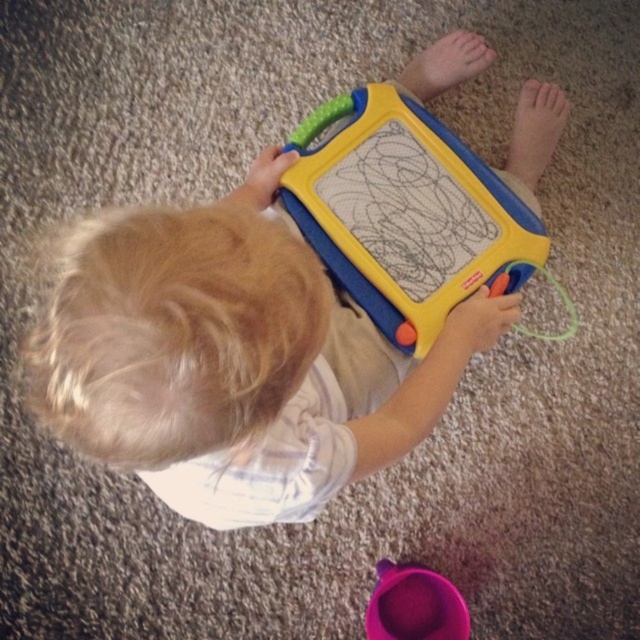
You are a parent observing your child playing with the yellow plastic drawing board at center and the purple plastic cup at lower center. Which object is bigger?

The yellow plastic drawing board at center is larger in size than the purple plastic cup at lower center.

Consider the image. You are a parent observing your child playing with the yellow plastic toy at center and the yellow plastic drawing board at center. Which object is positioned to the right side of the other?

The yellow plastic drawing board at center is to the right of the yellow plastic toy at center because the yellow plastic toy at center is to the left of the yellow plastic drawing board at center.